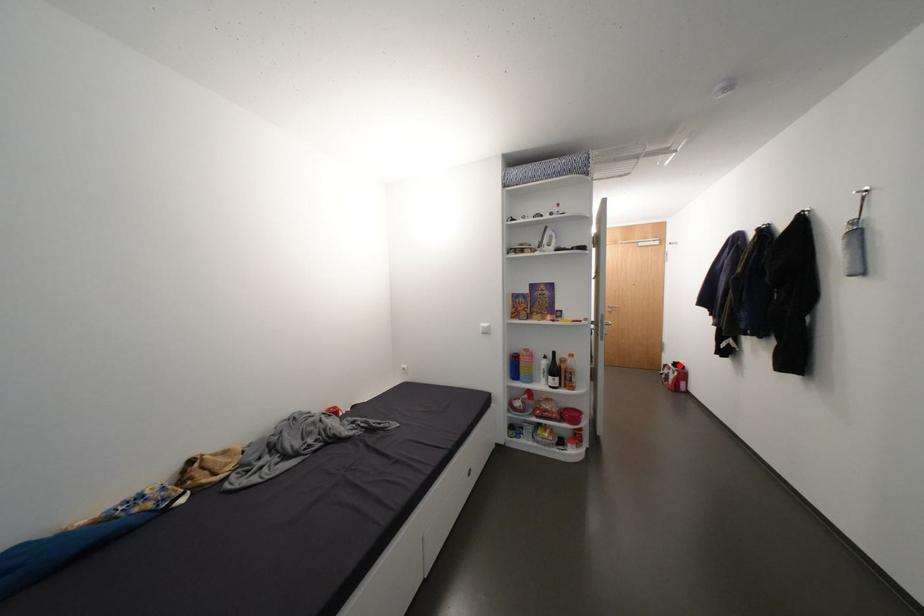
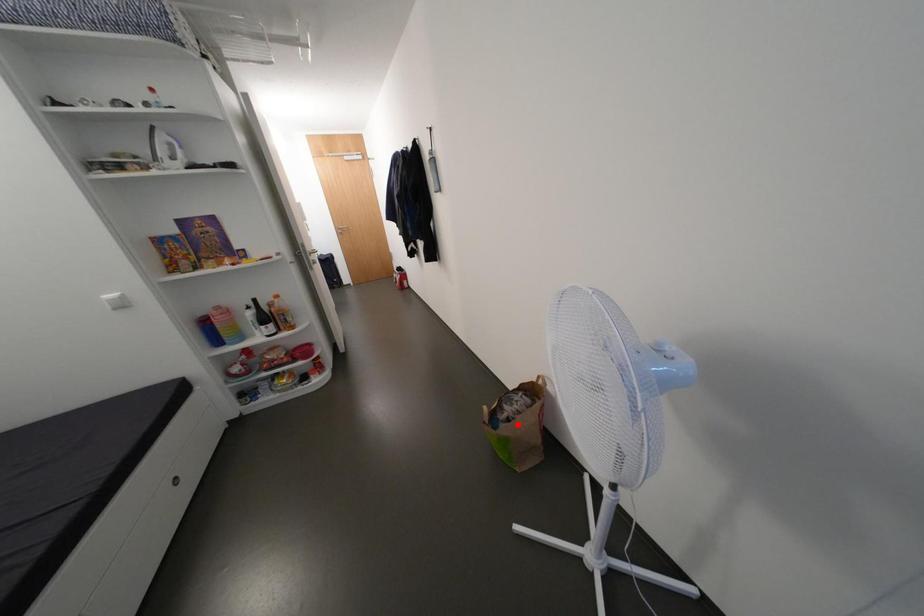
I am providing you with two images of the same scene from different viewpoints. A red point is marked on the first image and another point is marked on the second image. Is the red point in image1 aligned with the point shown in image2?

No